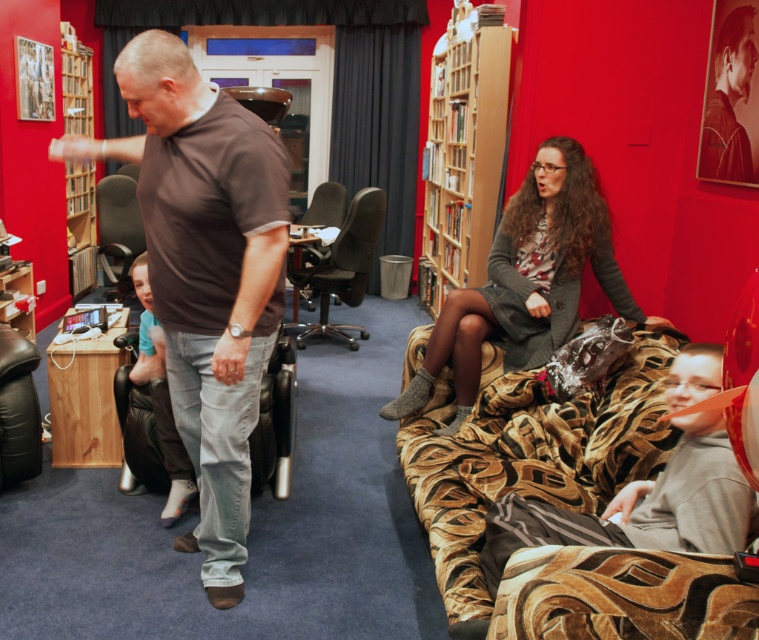
You are planning to place a new plant pot between the dark gray fabric office chair at center and the wooden bookshelf at left. Based on their current positions, which side of the bookshelf should the plant pot be placed on?

The dark gray fabric office chair at center is positioned on the right side of wooden bookshelf at left, so the plant pot should be placed on the right side of the wooden bookshelf at left to be between them.